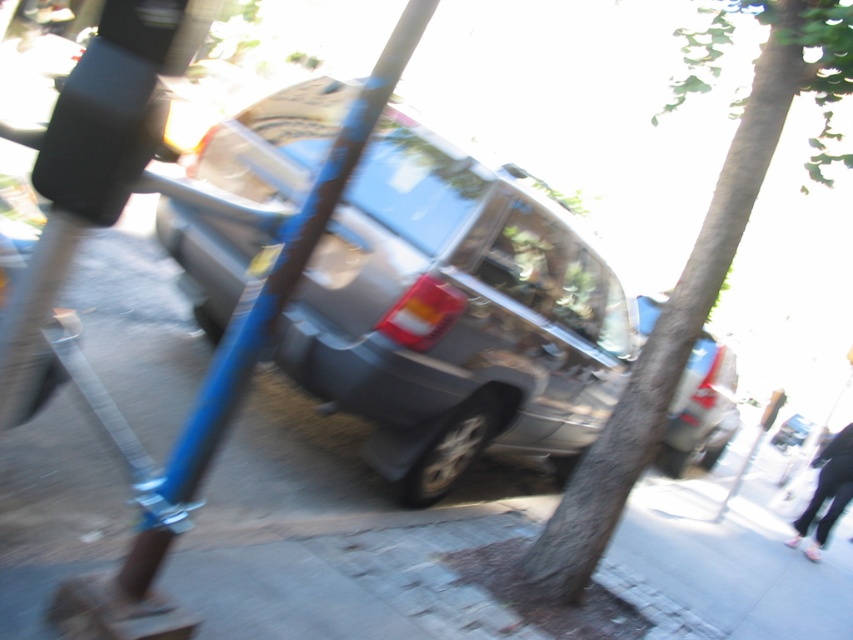
Is point (708, 595) positioned after point (231, 364)?

Yes, it is behind point (231, 364).

Does gray asphalt pavement at center have a lesser height compared to blue metallic pole at center?

Yes.

Find the location of a particular element. gray asphalt pavement at center is located at coordinates (306, 524).

Does point (386, 131) lie in front of point (428, 6)?

No, (386, 131) is further to viewer.

Does satin silver minivan at center appear under blue metallic pole at center?

Yes, satin silver minivan at center is below blue metallic pole at center.

Describe the element at coordinates (456, 316) in the screenshot. This screenshot has height=640, width=853. I see `satin silver minivan at center` at that location.

In order to click on satin silver minivan at center in this screenshot , I will do `click(456, 316)`.

Does green rough bark tree at center have a lesser width compared to blue metallic pole at center?

No, green rough bark tree at center is not thinner than blue metallic pole at center.

Looking at this image, is green rough bark tree at center closer to camera compared to blue metallic pole at center?

A: No.

Between point (724, 266) and point (389, 90), which one is positioned behind?

Positioned behind is point (724, 266).

Locate an element on the screen. green rough bark tree at center is located at coordinates (697, 266).